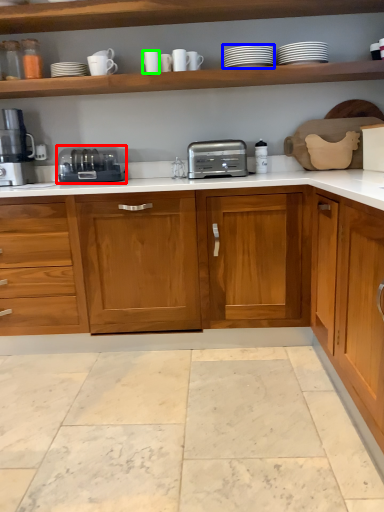
Question: Which object is positioned farthest from toaster (highlighted by a red box)? Select from tableware (highlighted by a blue box) and tableware (highlighted by a green box).

Choices:
 (A) tableware
 (B) tableware

Answer: (A)